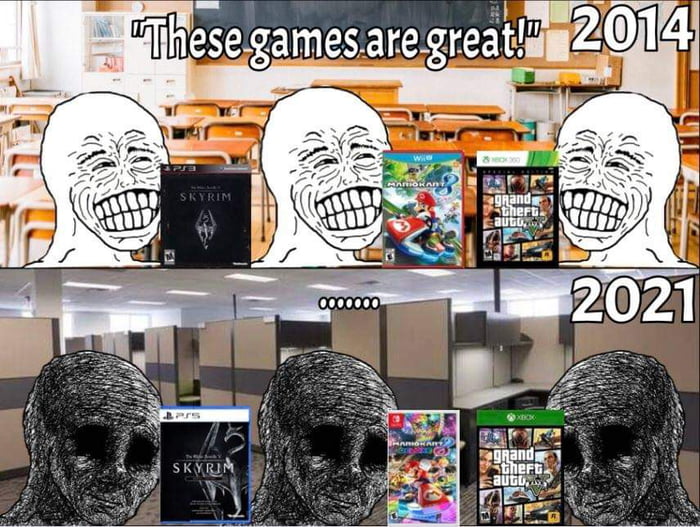
Locate an element on the screen. classroom is located at coordinates (236, 86).